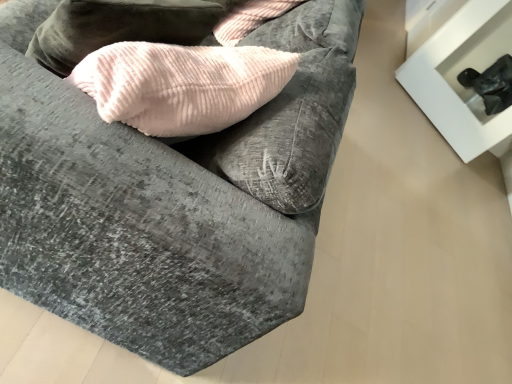
Question: From the image's perspective, is velvet gray couch at center above or below black matte table at upper right?

Choices:
 (A) below
 (B) above

Answer: (A)

Question: Does point (253, 210) appear closer or farther from the camera than point (484, 11)?

Choices:
 (A) closer
 (B) farther

Answer: (A)

Question: Considering the positions of velvet gray couch at center and black matte table at upper right in the image, is velvet gray couch at center taller or shorter than black matte table at upper right?

Choices:
 (A) short
 (B) tall

Answer: (A)

Question: From the image's perspective, is black matte table at upper right positioned above or below velvet gray couch at center?

Choices:
 (A) below
 (B) above

Answer: (B)

Question: Is point (478, 61) closer or farther from the camera than point (210, 193)?

Choices:
 (A) farther
 (B) closer

Answer: (A)

Question: From their relative heights in the image, would you say black matte table at upper right is taller or shorter than velvet gray couch at center?

Choices:
 (A) short
 (B) tall

Answer: (B)

Question: From a real-world perspective, is black matte table at upper right positioned above or below velvet gray couch at center?

Choices:
 (A) above
 (B) below

Answer: (A)